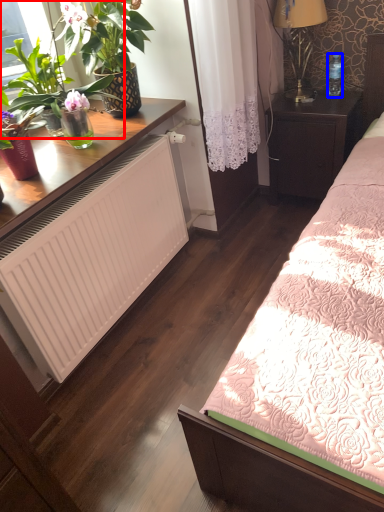
Question: Which object is further to the camera taking this photo, houseplant (highlighted by a red box) or bottle (highlighted by a blue box)?

Choices:
 (A) houseplant
 (B) bottle

Answer: (B)